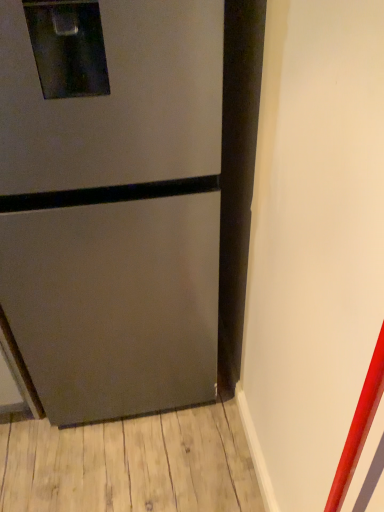
At what (x,y) coordinates should I click in order to perform the action: click on satin metallic refrigerator at center-left. Please return your answer as a coordinate pair (x, y). Looking at the image, I should click on (112, 201).

What do you see at coordinates (112, 201) in the screenshot? I see `satin metallic refrigerator at center-left` at bounding box center [112, 201].

This screenshot has width=384, height=512. I want to click on satin metallic refrigerator at center-left, so click(x=112, y=201).